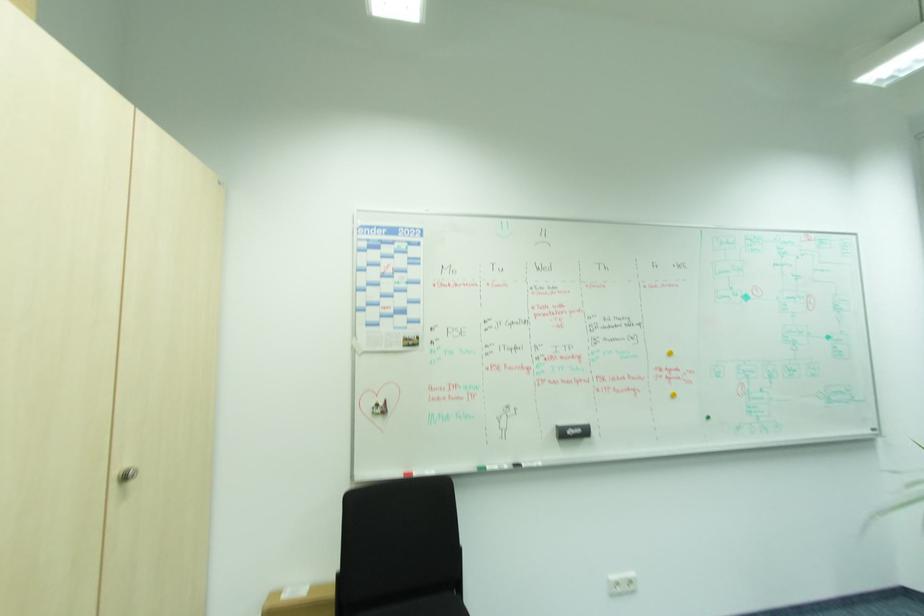
The width and height of the screenshot is (924, 616). I want to click on red whiteboard marker, so click(x=419, y=472).